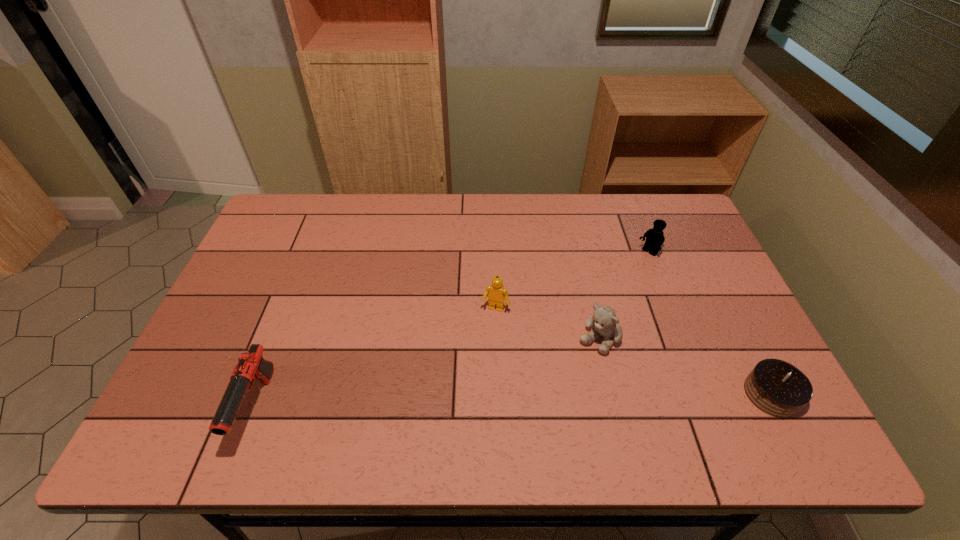
This screenshot has width=960, height=540. In order to click on the leftmost object in this screenshot , I will do `click(251, 364)`.

The width and height of the screenshot is (960, 540). In order to click on the rightmost object in this screenshot , I will do pos(778,388).

The width and height of the screenshot is (960, 540). Find the location of `the shortest object`. the shortest object is located at coordinates (778, 388).

This screenshot has width=960, height=540. Find the location of `the second object from left to right`. the second object from left to right is located at coordinates (496, 293).

Identify the location of the nearer Lego. (496, 293).

You are a GUI agent. You are given a task and a screenshot of the screen. Output one action in this format:
    pyautogui.click(x=<x>, y=<y>)
    Task: Click on the third nearest object
    The height and width of the screenshot is (540, 960).
    Given the screenshot: What is the action you would take?
    pyautogui.click(x=604, y=319)

Image resolution: width=960 pixels, height=540 pixels. What are the coordinates of `teddy bear` in the screenshot? It's located at click(x=604, y=319).

Image resolution: width=960 pixels, height=540 pixels. I want to click on the farther Lego, so click(x=655, y=238).

Image resolution: width=960 pixels, height=540 pixels. Identify the location of the fourth object from left to right. (655, 238).

At what (x,y) coordinates should I click in order to perform the action: click on vacant space located 0.240m on the back of the rightmost object. Please return your answer as a coordinate pair (x, y). Image resolution: width=960 pixels, height=540 pixels. Looking at the image, I should click on (723, 299).